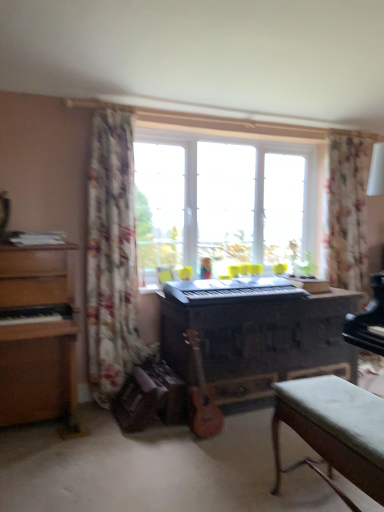
Identify the location of blank space situated above green fabric bench at lower right (from a real-world perspective). (342, 401).